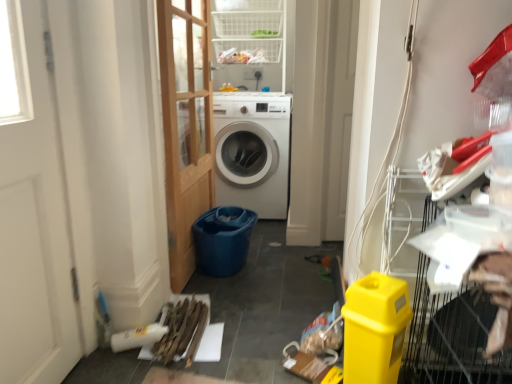
This screenshot has width=512, height=384. Find the location of `free space above yellow plastic bin at lower right (from a real-world perspective)`. free space above yellow plastic bin at lower right (from a real-world perspective) is located at coordinates (378, 281).